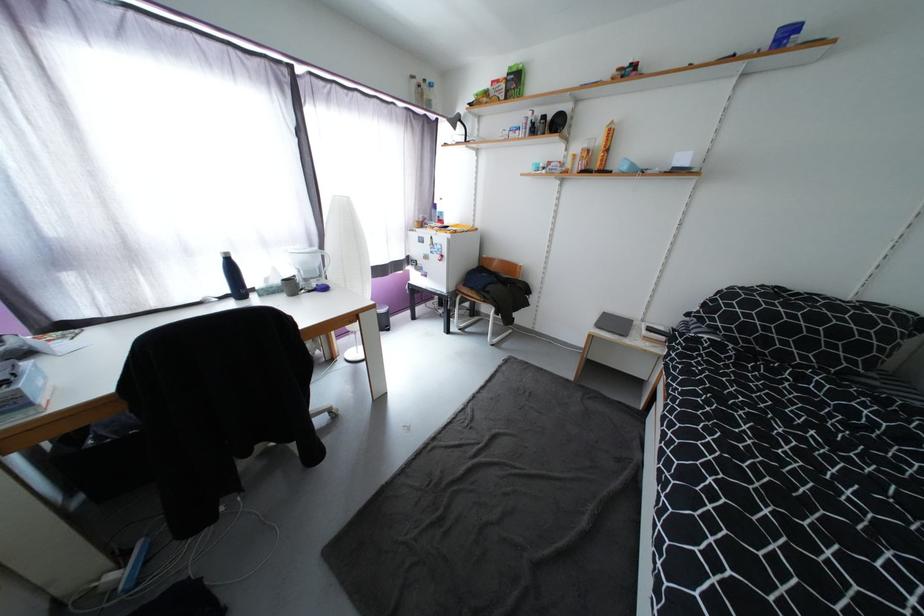
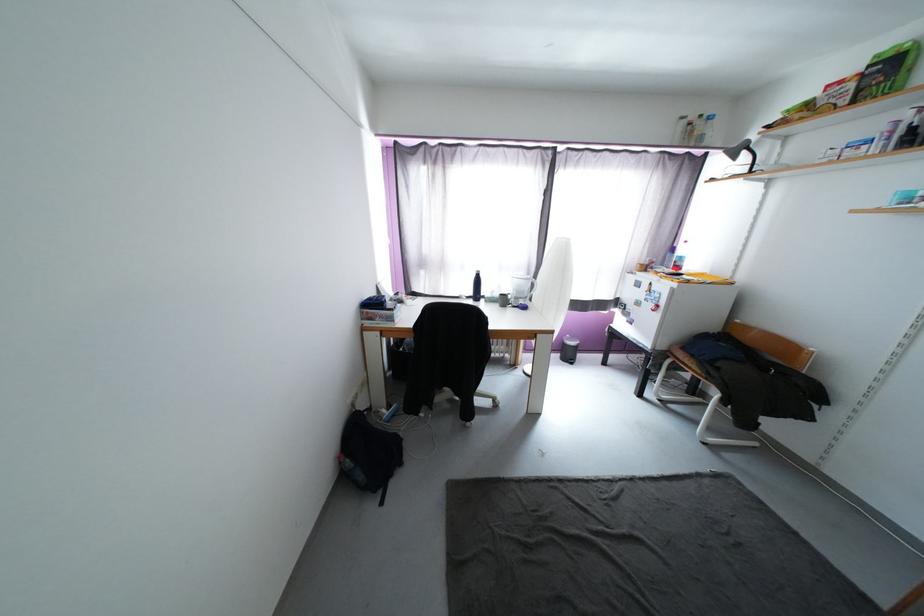
Find the pixel in the second image that matches [532,306] in the first image.

(812, 419)